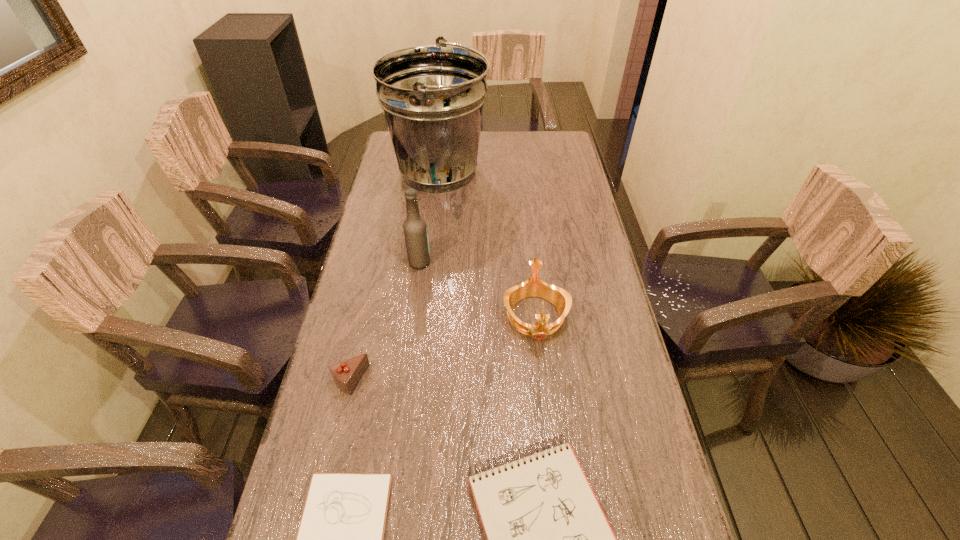
The image size is (960, 540). I want to click on free space at the far right corner of the desktop, so click(x=540, y=146).

You are a GUI agent. You are given a task and a screenshot of the screen. Output one action in this format:
    pyautogui.click(x=<x>, y=<y>)
    Task: Click on the vacant area that lies between the farthest object and the third shortest object
    The width and height of the screenshot is (960, 540).
    Given the screenshot: What is the action you would take?
    pyautogui.click(x=395, y=276)

The height and width of the screenshot is (540, 960). I want to click on free space between the second farthest object and the tiara, so click(477, 289).

Identify the location of vacant space in between the fourth shortest object and the tallest object. (488, 244).

Locate an element on the screen. empty space that is in between the third shortest object and the second farthest object is located at coordinates (385, 321).

This screenshot has width=960, height=540. In order to click on object that stands as the third closest to the third shortest object in this screenshot , I will do `click(415, 229)`.

I want to click on object that is the closest to the shorter notepad, so click(547, 538).